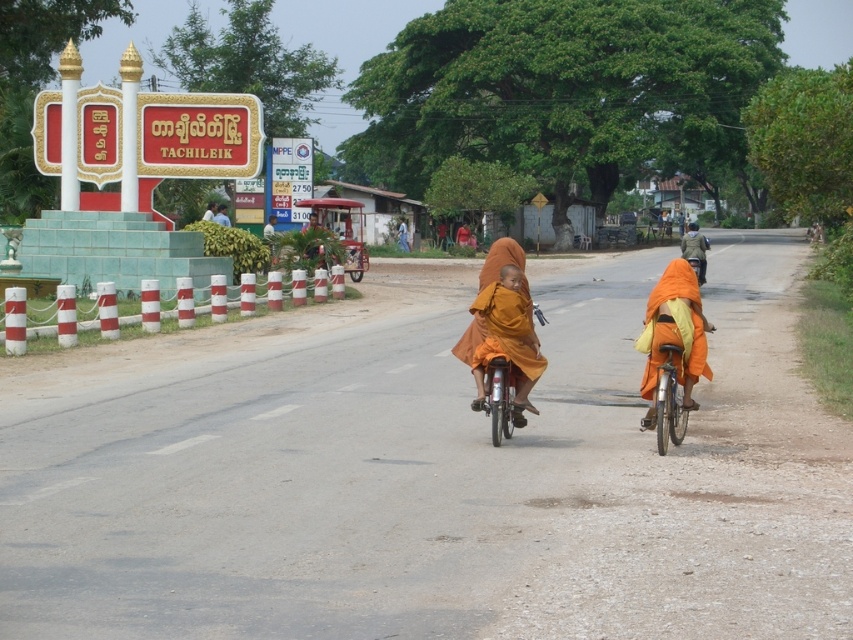
Question: In this image, where is metallic orange bicycle at center located relative to camouflage fabric jacket at right?

Choices:
 (A) below
 (B) above

Answer: (A)

Question: Does metallic orange bicycle at center appear under camouflage fabric jacket at right?

Choices:
 (A) yes
 (B) no

Answer: (A)

Question: In this image, where is metallic orange bicycle at center located relative to camouflage fabric jacket at right?

Choices:
 (A) left
 (B) right

Answer: (A)